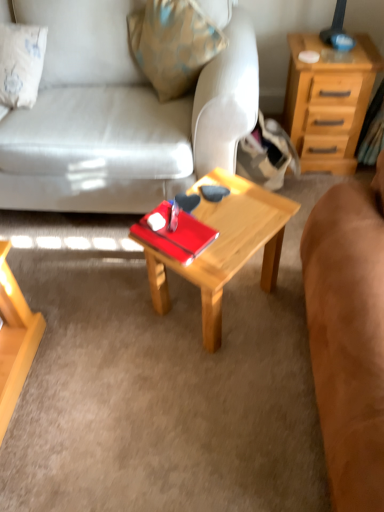
Identify the location of free space to the left of wooden coffee table at center. Image resolution: width=384 pixels, height=512 pixels. (118, 311).